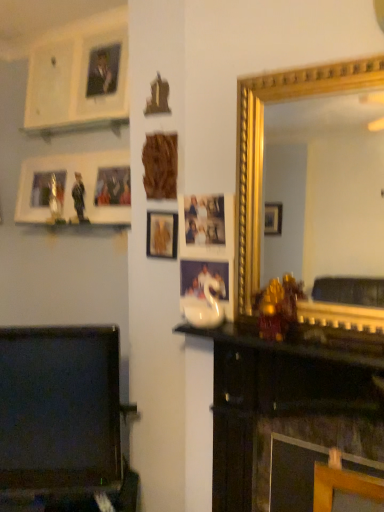
Question: From a real-world perspective, is wooden carving at center, placed as the 2th picture frame when sorted from left to right, over smooth black tv at lower left?

Choices:
 (A) yes
 (B) no

Answer: (A)

Question: Considering the relative positions of wooden carving at center, the 2th picture frame positioned from the right, and smooth black tv at lower left in the image provided, is wooden carving at center, the 2th picture frame positioned from the right, to the right of smooth black tv at lower left from the viewer's perspective?

Choices:
 (A) yes
 (B) no

Answer: (A)

Question: From a real-world perspective, is wooden carving at center, the 2th picture frame positioned from the right, positioned under smooth black tv at lower left based on gravity?

Choices:
 (A) no
 (B) yes

Answer: (A)

Question: Is wooden carving at center, marked as the third picture frame in a back-to-front arrangement, looking in the opposite direction of smooth black tv at lower left?

Choices:
 (A) yes
 (B) no

Answer: (B)

Question: Can you confirm if wooden carving at center, placed as the 1th picture frame when sorted from front to back, is bigger than smooth black tv at lower left?

Choices:
 (A) no
 (B) yes

Answer: (A)

Question: Do you think black glossy mantle at center is within gold/gilded mirror at center-right, or outside of it?

Choices:
 (A) outside
 (B) inside

Answer: (A)

Question: Is black glossy mantle at center wider or thinner than gold/gilded mirror at center-right?

Choices:
 (A) thin
 (B) wide

Answer: (B)

Question: From their relative heights in the image, would you say black glossy mantle at center is taller or shorter than gold/gilded mirror at center-right?

Choices:
 (A) short
 (B) tall

Answer: (A)

Question: From a real-world perspective, is black glossy mantle at center above or below gold/gilded mirror at center-right?

Choices:
 (A) below
 (B) above

Answer: (A)

Question: In terms of height, does wooden picture frame at upper left, which appears as the first picture frame when viewed from the back, look taller or shorter compared to gold/gilded mirror at center-right?

Choices:
 (A) short
 (B) tall

Answer: (A)

Question: Is wooden picture frame at upper left, which is the 1th picture frame in left-to-right order, to the left or to the right of gold/gilded mirror at center-right in the image?

Choices:
 (A) right
 (B) left

Answer: (B)

Question: Looking at the image, does wooden picture frame at upper left, which appears as the first picture frame when viewed from the back, seem bigger or smaller compared to gold/gilded mirror at center-right?

Choices:
 (A) small
 (B) big

Answer: (B)

Question: From the image's perspective, is wooden picture frame at upper left, placed as the third picture frame when sorted from front to back, above or below gold/gilded mirror at center-right?

Choices:
 (A) above
 (B) below

Answer: (A)

Question: From the image's perspective, is smooth black tv at lower left above or below gold/gilded mirror at center-right?

Choices:
 (A) above
 (B) below

Answer: (B)

Question: Considering the positions of point (82, 391) and point (336, 131), is point (82, 391) closer or farther from the camera than point (336, 131)?

Choices:
 (A) closer
 (B) farther

Answer: (A)